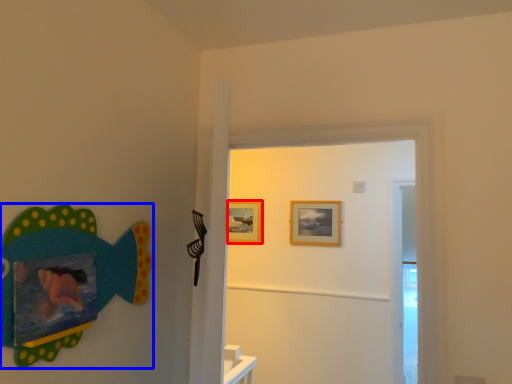
Question: Which point is closer to the camera, picture frame (highlighted by a red box) or fish (highlighted by a blue box)?

Choices:
 (A) picture frame
 (B) fish

Answer: (B)